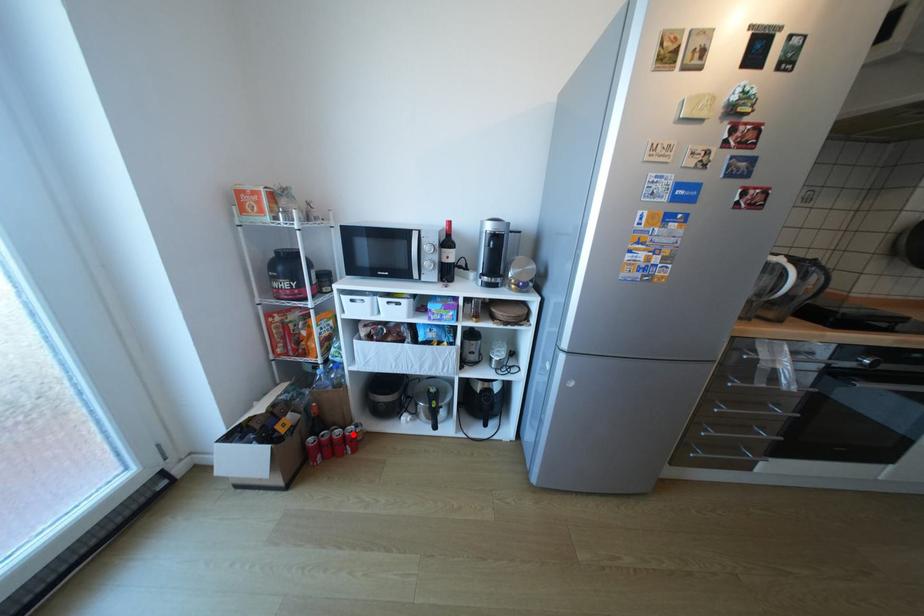
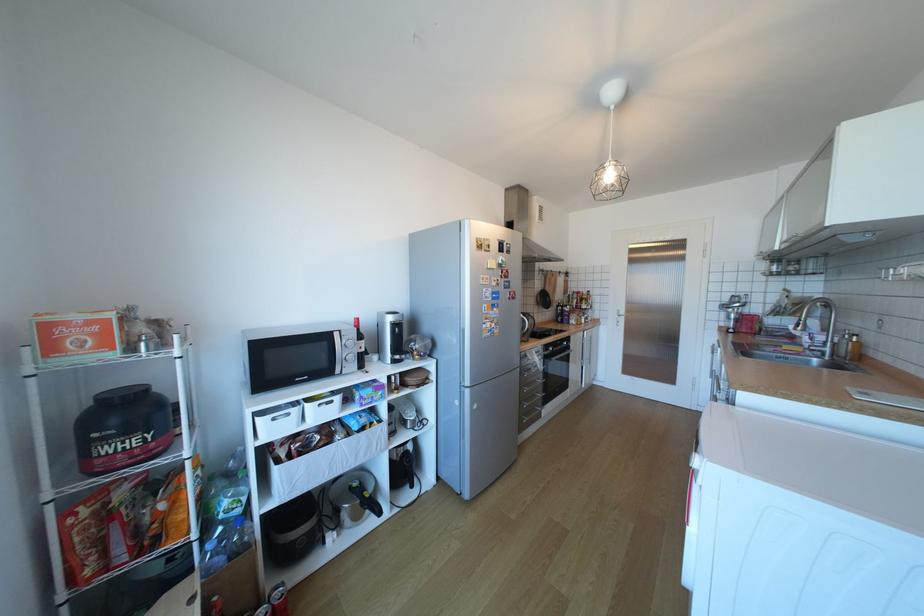
Question: I am providing you with two images of the same scene from different viewpoints. Given a red point in image1, look at the same physical point in image2. Is it:

Choices:
 (A) Closer to the viewpoint
 (B) Farther from the viewpoint

Answer: (A)